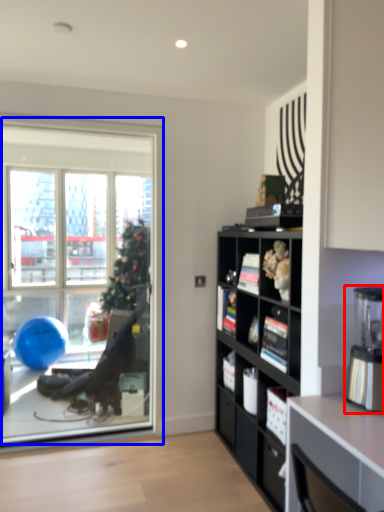
Question: Which object is closer to the camera taking this photo, coffee machine (highlighted by a red box) or window (highlighted by a blue box)?

Choices:
 (A) coffee machine
 (B) window

Answer: (A)